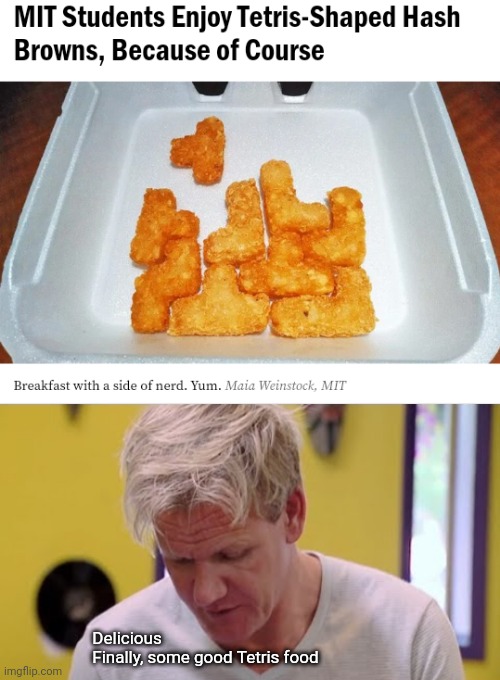
Locate an element on the screen. The height and width of the screenshot is (680, 500). wall is located at coordinates (74, 494).